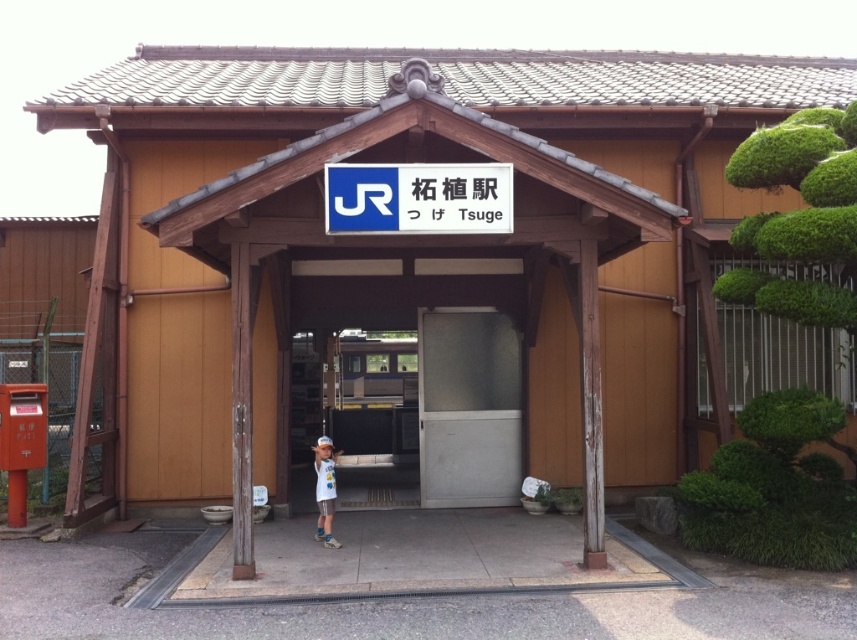
Is white matte door at center taller than white cotton shirt at center?

Correct, white matte door at center is much taller as white cotton shirt at center.

Can you confirm if white matte door at center is bigger than white cotton shirt at center?

Indeed, white matte door at center has a larger size compared to white cotton shirt at center.

Between point (482, 497) and point (321, 472), which one is positioned in front?

Point (321, 472) is in front.

This screenshot has width=857, height=640. I want to click on white matte door at center, so click(x=466, y=406).

Does white matte door at center lie behind blue plastic sign at center?

Yes, it is.

Is point (519, 445) positioned after point (339, 225)?

Yes, it is.

Where is `white matte door at center`? The height and width of the screenshot is (640, 857). white matte door at center is located at coordinates (466, 406).

Is point (346, 225) closer to viewer compared to point (321, 438)?

Yes.

Which is in front, point (427, 189) or point (324, 522)?

Positioned in front is point (427, 189).

At what (x,y) coordinates should I click in order to perform the action: click on blue plastic sign at center. Please return your answer as a coordinate pair (x, y). This screenshot has height=640, width=857. Looking at the image, I should click on (418, 198).